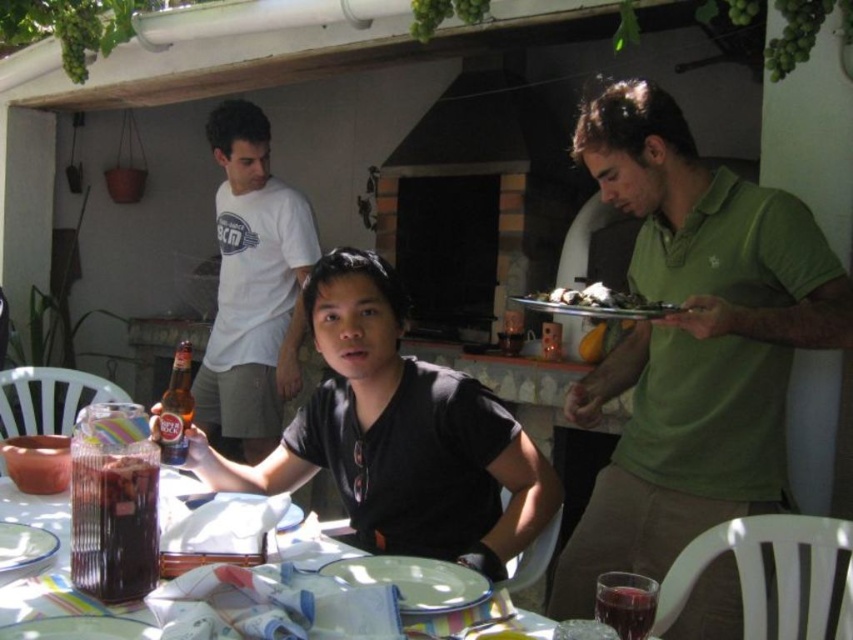
You are standing at the edge of the patio and want to walk towards the point labeled as point (434, 611). Which direction should you walk relative to the point labeled as point (547, 300)?

You should walk towards the point labeled as point (434, 611), which is in front of the point labeled as point (547, 300).

Where is the translucent glass table at lower left located in the image?

The translucent glass table at lower left is located at point (36, 513).

You are arranging a dessert display on the table and need to place the shiny silver platter at center and the metallic silver platter at right. According to the current setup, which platter is positioned higher up?

The shiny silver platter at center is positioned higher up than the metallic silver platter at right.